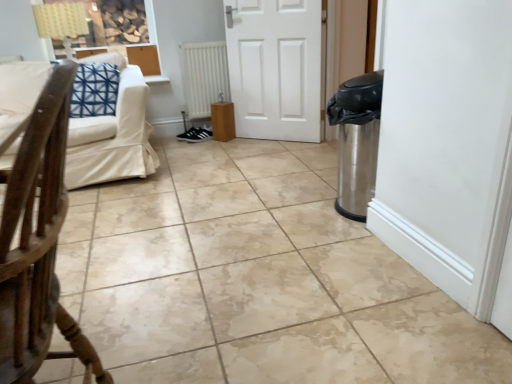
At what (x,y) coordinates should I click in order to perform the action: click on vacant space in between wooden chair at left and black suede sneakers at center. Please return your answer as a coordinate pair (x, y). The image size is (512, 384). Looking at the image, I should click on (162, 226).